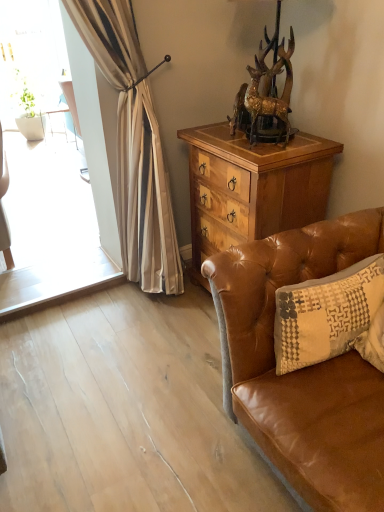
Find the location of a particular element. The width and height of the screenshot is (384, 512). free location to the right of gold metallic deer at upper center is located at coordinates (297, 145).